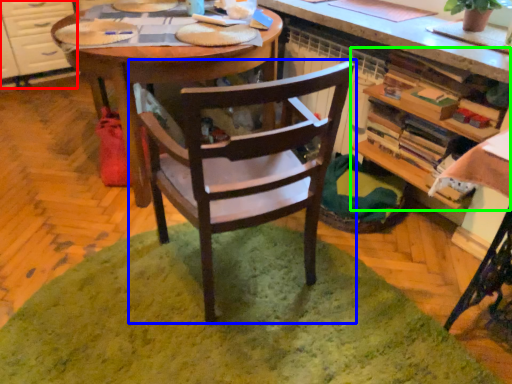
Question: Which object is the closest to the cabinetry (highlighted by a red box)? Choose among these: chair (highlighted by a blue box) or shelf (highlighted by a green box).

Choices:
 (A) chair
 (B) shelf

Answer: (A)